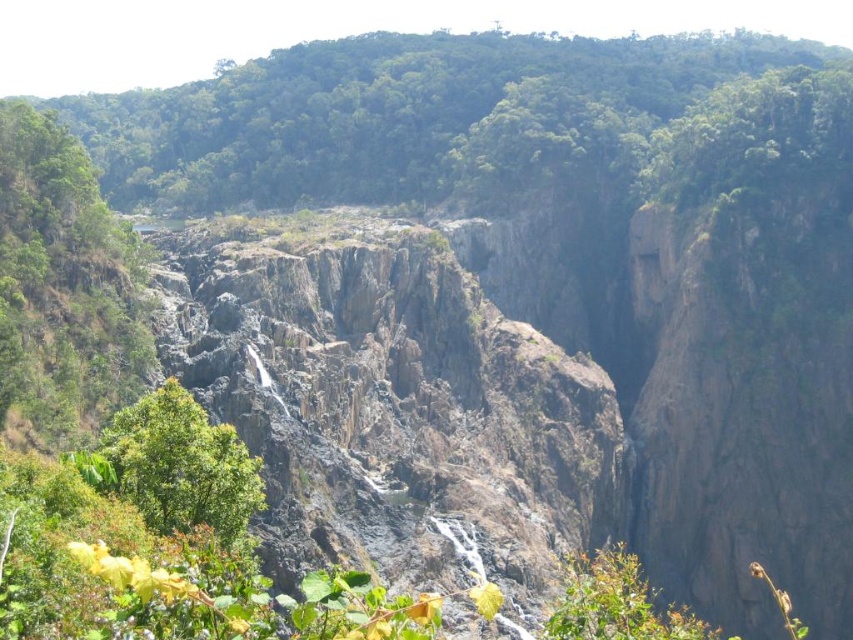
You are a hiker planning to cross the canyon using a narrow path. You notice two trees, the green leafy trees at upper center and the green leafy tree at lower left. Which tree has a wider canopy that could provide more shade?

The green leafy trees at upper center has a larger width than the green leafy tree at lower left, so it provides a wider canopy and more shade.

You are standing at the base of the canyon and looking up. You see the green leafy trees at upper center and the green leafy tree at lower left. Which of these trees is higher up in the scene?

The green leafy trees at upper center is higher up in the scene than the green leafy tree at lower left.

You are a hiker standing at the edge of the canyon and see the green leafy trees at upper center and the green leafy tree at lower left. Which tree would you estimate to be taller?

The green leafy trees at upper center is taller than the green leafy tree at lower left according to the description.